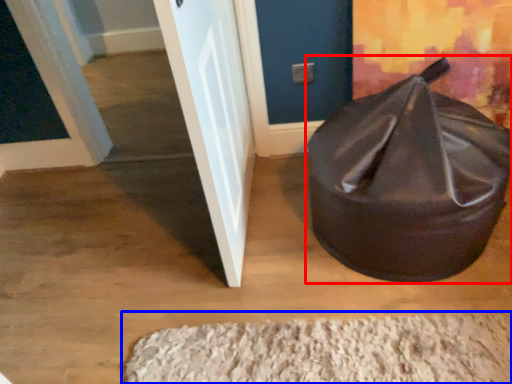
Question: Which object is closer to the camera taking this photo, bean bag chair (highlighted by a red box) or doormat (highlighted by a blue box)?

Choices:
 (A) bean bag chair
 (B) doormat

Answer: (A)